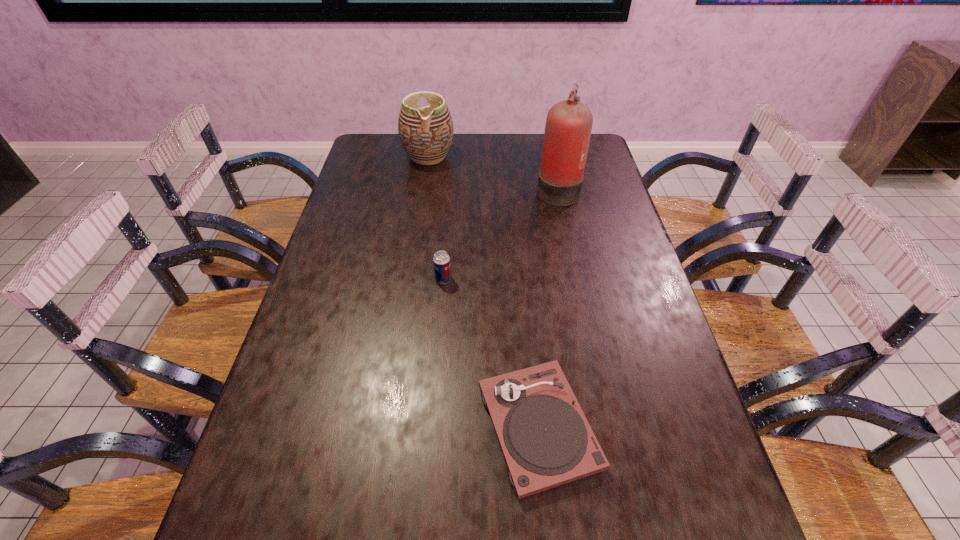
You are a GUI agent. You are given a task and a screenshot of the screen. Output one action in this format:
    pyautogui.click(x=<x>, y=<y>)
    Task: Click on the unoccupied position between the third tallest object and the nearest object
    The image size is (960, 540).
    Given the screenshot: What is the action you would take?
    pyautogui.click(x=491, y=353)

Identify which object is located as the second nearest to the second nearest object. Please provide its 2D coordinates. Your answer should be formatted as a tuple, i.e. [(x, y)], where the tuple contains the x and y coordinates of a point satisfying the conditions above.

[(568, 127)]

Identify the location of the closest object relative to the third shortest object. (568, 127).

You are a GUI agent. You are given a task and a screenshot of the screen. Output one action in this format:
    pyautogui.click(x=<x>, y=<y>)
    Task: Click on the free spot that satisfies the following two spatial constraints: 1. on the front side of the beer can; 2. on the left side of the shortest object
    The image size is (960, 540).
    Given the screenshot: What is the action you would take?
    pyautogui.click(x=431, y=427)

Where is `vacant region that satisfies the following two spatial constraints: 1. at the nozzle of the tallest object; 2. on the front side of the nearest object`? vacant region that satisfies the following two spatial constraints: 1. at the nozzle of the tallest object; 2. on the front side of the nearest object is located at coordinates (608, 427).